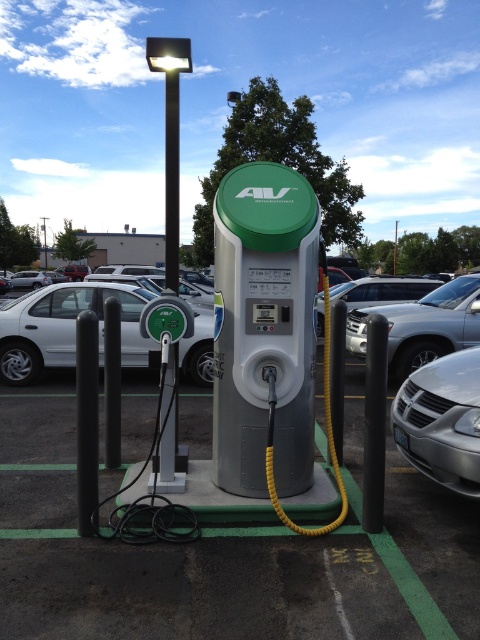
Question: Among these objects, which one is nearest to the camera?

Choices:
 (A) metallic pole at upper center
 (B) silver metallic suv at center right
 (C) white matte sedan at left
 (D) black metal pole at upper center

Answer: (D)

Question: Estimate the real-world distances between objects in this image. Which object is closer to the black metal pole at upper center?

Choices:
 (A) metallic pole at upper center
 (B) green plastic charging station at center
 (C) silver metallic car at lower right

Answer: (B)

Question: In this image, where is silver metallic car at lower right located relative to silver metallic suv at center right?

Choices:
 (A) below
 (B) above

Answer: (A)

Question: Among these points, which one is farthest from the camera?

Choices:
 (A) (362, 333)
 (B) (41, 228)

Answer: (B)

Question: Is black metal pole at upper center in front of metallic pole at upper center?

Choices:
 (A) yes
 (B) no

Answer: (A)

Question: Can you confirm if silver metallic car at lower right is bigger than black metal pole at upper center?

Choices:
 (A) no
 (B) yes

Answer: (A)